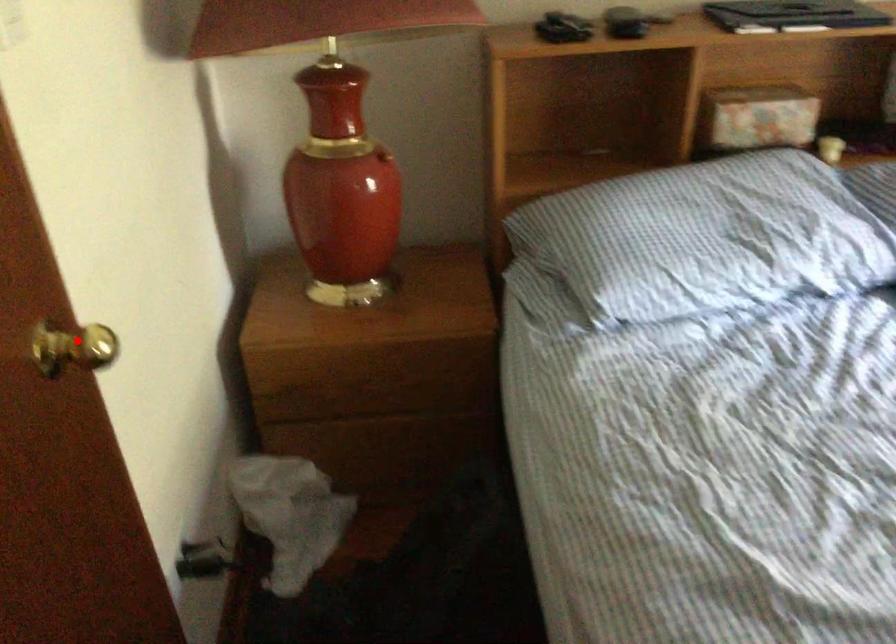
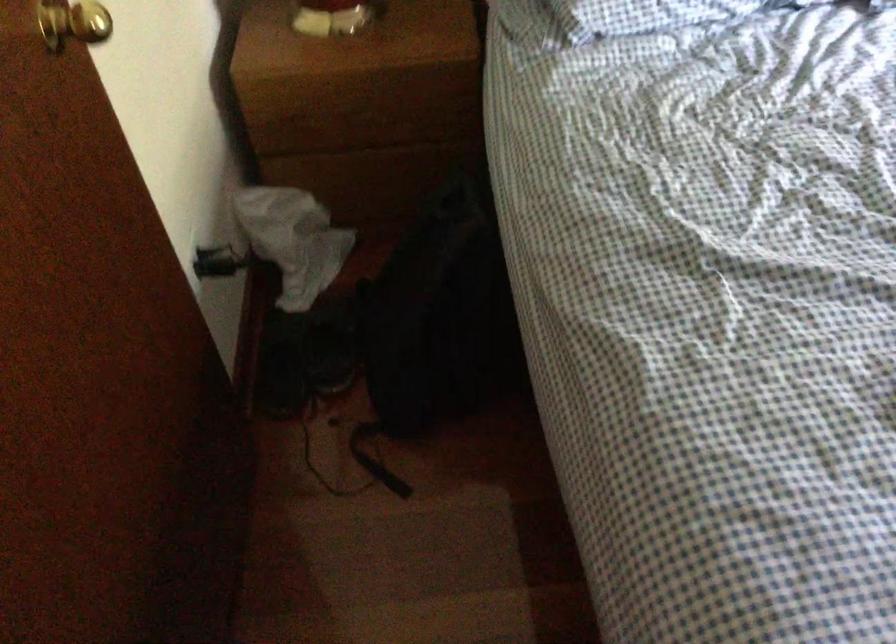
Question: I am providing you with two images of the same scene from different viewpoints. Given a red point in image1, look at the same physical point in image2. Is it:

Choices:
 (A) Closer to the viewpoint
 (B) Farther from the viewpoint

Answer: (B)